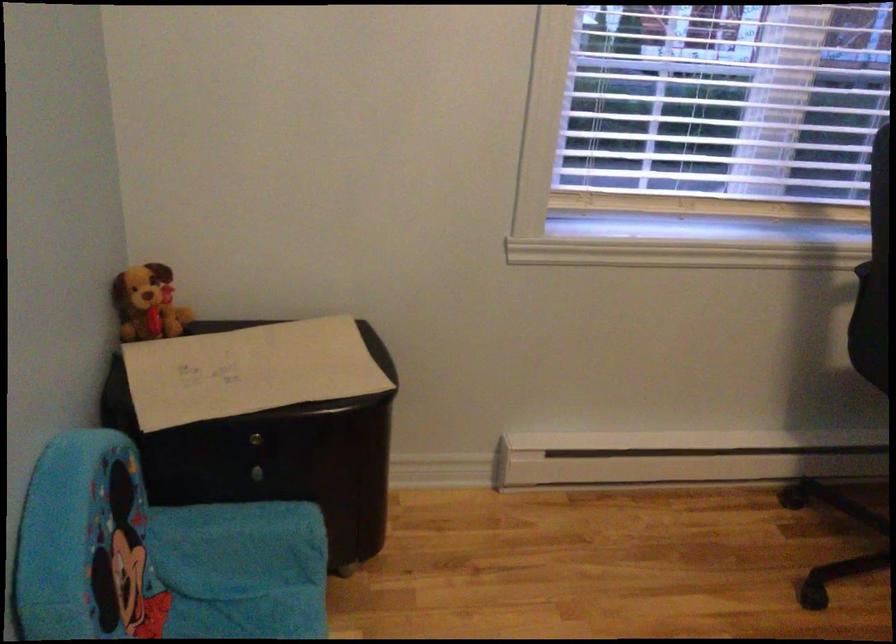
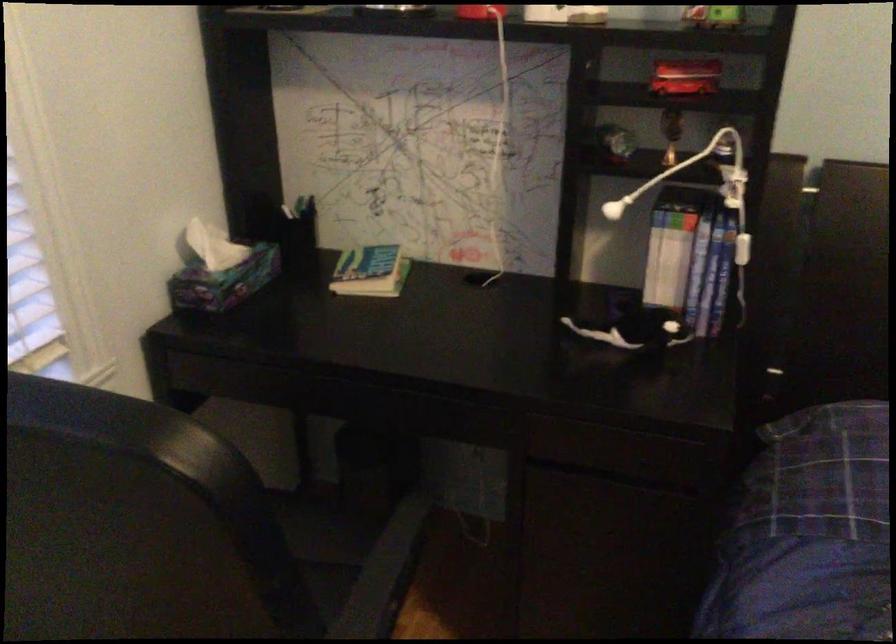
Based on the continuous images, in which direction is the camera rotating?

The camera's rotation is toward right-down.